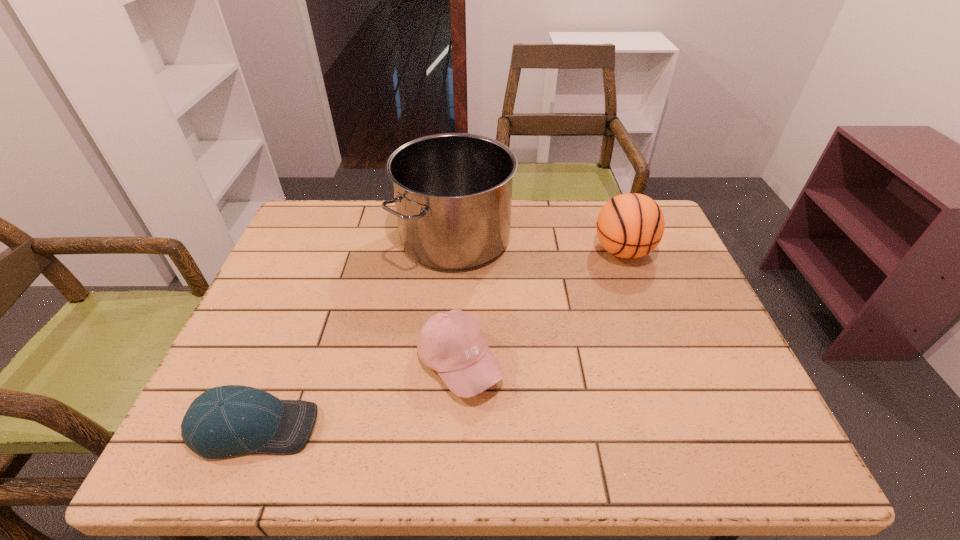
Locate which object ranks second in proximity to the third shortest object. Please provide its 2D coordinates. Your answer should be formatted as a tuple, i.e. [(x, y)], where the tuple contains the x and y coordinates of a point satisfying the conditions above.

[(452, 343)]

Identify which object is the third closest to the tallest object. Please provide its 2D coordinates. Your answer should be formatted as a tuple, i.e. [(x, y)], where the tuple contains the x and y coordinates of a point satisfying the conditions above.

[(224, 421)]

The height and width of the screenshot is (540, 960). What are the coordinates of `free location that satisfies the following two spatial constraints: 1. on the front side of the rightmost object; 2. on the front-facing side of the right baseball cap` in the screenshot? It's located at (664, 363).